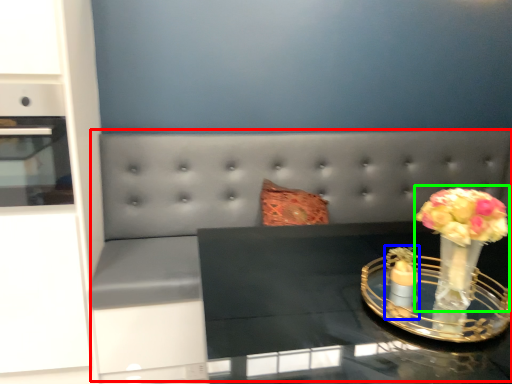
Question: Which object is positioned closest to couch (highlighted by a red box)? Select from candle holder (highlighted by a blue box) and floral arrangement (highlighted by a green box).

Choices:
 (A) candle holder
 (B) floral arrangement

Answer: (A)